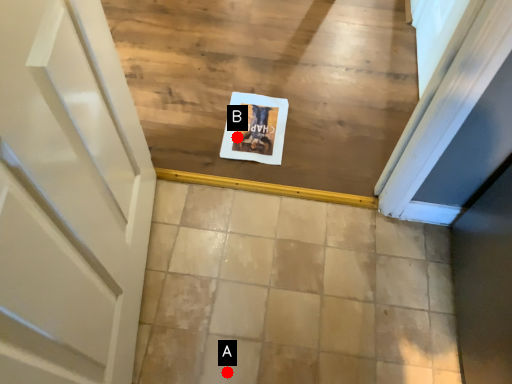
Question: Two points are circled on the image, labeled by A and B beside each circle. Which of the following is the farthest from the observer?

Choices:
 (A) A is further
 (B) B is further

Answer: (B)